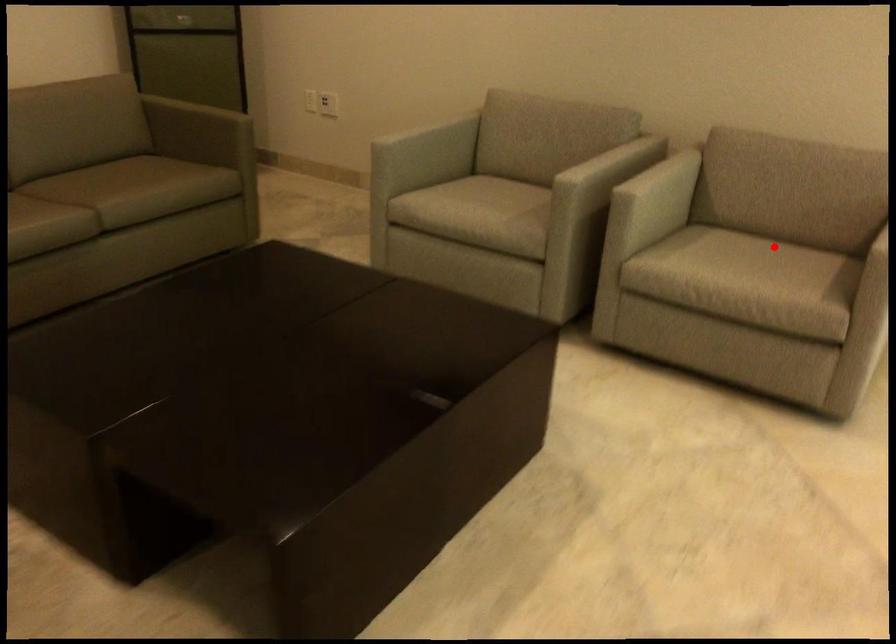
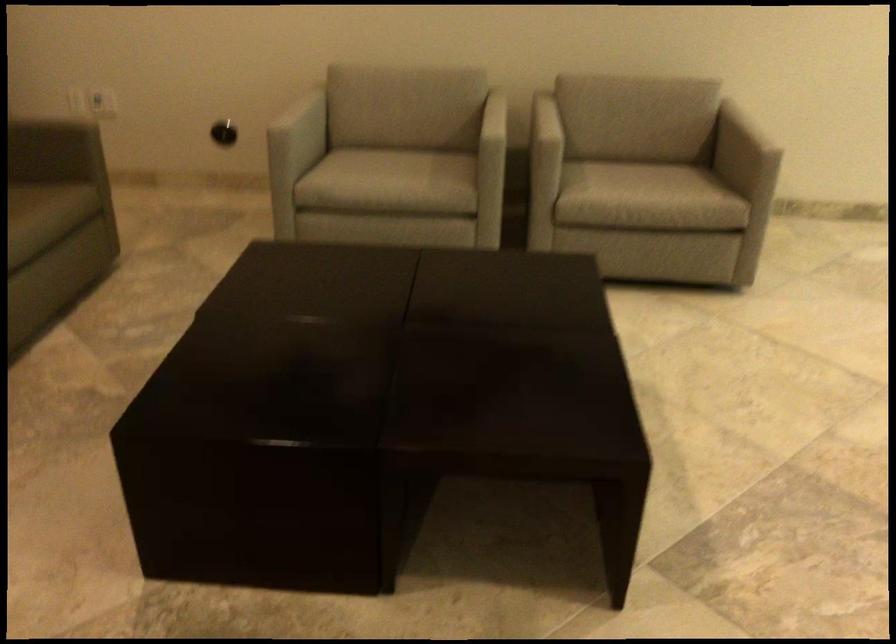
The point at the highlighted location is marked in the first image. Where is the corresponding point in the second image?

(633, 160)